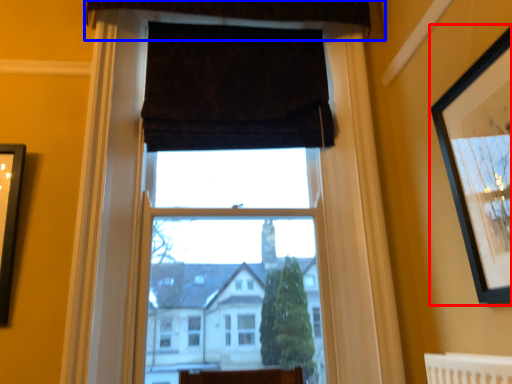
Question: Among these objects, which one is farthest to the camera, picture frame (highlighted by a red box) or curtain (highlighted by a blue box)?

Choices:
 (A) picture frame
 (B) curtain

Answer: (B)